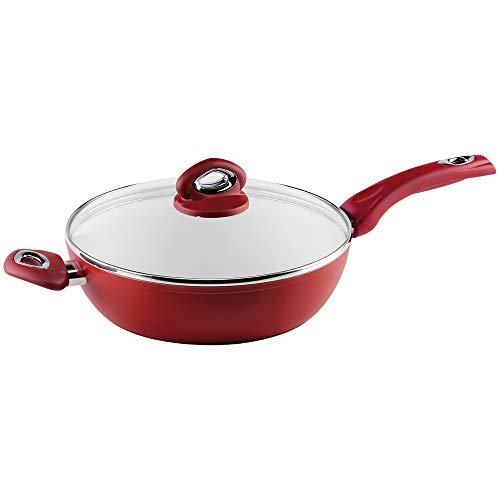
Locate an element on the screen. The height and width of the screenshot is (500, 500). secondary handle on pan is located at coordinates (26, 277).